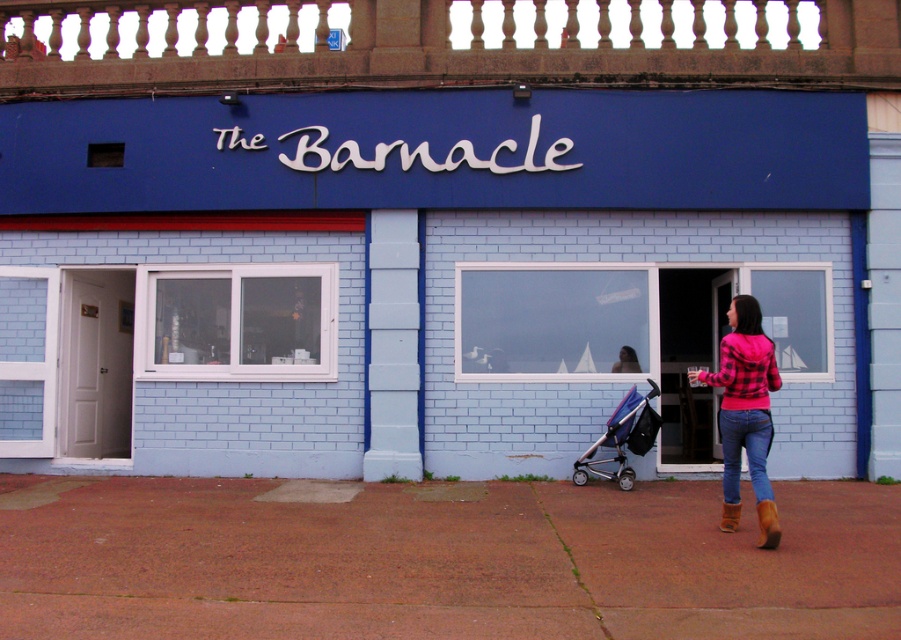
Question: Which object is the farthest from the brown suede boot at lower right?

Choices:
 (A) metallic blue stroller at center
 (B) blue denim jeans at lower right
 (C) pink plaid sweater at lower right
 (D) red brick pavement at lower center

Answer: (A)

Question: Among these objects, which one is farthest from the camera?

Choices:
 (A) metallic blue stroller at center
 (B) red brick pavement at lower center
 (C) pink plaid sweater at lower right
 (D) blue denim jeans at lower right

Answer: (A)

Question: Which object is the farthest from the blue denim jeans at lower right?

Choices:
 (A) pink plaid sweater at lower right
 (B) metallic blue stroller at center
 (C) brown leather boot at lower right
 (D) brown suede boot at lower right

Answer: (B)

Question: Is pink plaid sweater at lower right below blue denim jeans at lower right?

Choices:
 (A) no
 (B) yes

Answer: (A)

Question: Can you confirm if pink plaid sweater at lower right is smaller than metallic blue stroller at center?

Choices:
 (A) no
 (B) yes

Answer: (A)

Question: Is pink plaid sweater at lower right wider than brown leather boot at lower right?

Choices:
 (A) yes
 (B) no

Answer: (A)